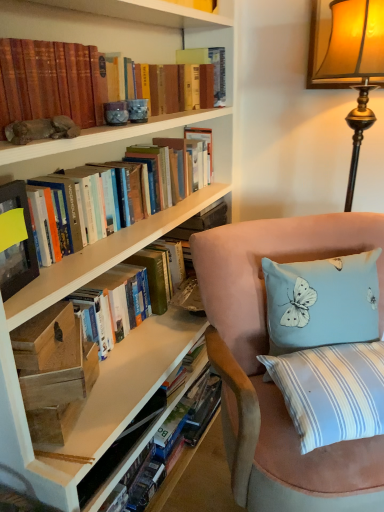
Question: Considering the positions of hardcover book at upper center, which is counted as the 4th paperback book, starting from the front, and wooden box at lower left, which is the third paperback book from right to left, in the image, is hardcover book at upper center, which is counted as the 4th paperback book, starting from the front, wider or thinner than wooden box at lower left, which is the third paperback book from right to left,?

Choices:
 (A) thin
 (B) wide

Answer: (B)

Question: Considering the relative positions of hardcover book at upper center, which is counted as the 4th paperback book, starting from the front, and wooden box at lower left, the 3th paperback book positioned from the back, in the image provided, is hardcover book at upper center, which is counted as the 4th paperback book, starting from the front, to the left or to the right of wooden box at lower left, the 3th paperback book positioned from the back,?

Choices:
 (A) left
 (B) right

Answer: (B)

Question: Estimate the real-world distances between objects in this image. Which object is closer to the hardcover book at upper center, which is counted as the 4th paperback book, starting from the front?

Choices:
 (A) light blue fabric pillow with butterfly design at right
 (B) wooden box at lower left, the 3th paperback book positioned from the back
 (C) gold textured lampshade at upper right
 (D) suede chair at lower right
 (E) hardcover books at upper left, the 1th book positioned from the top

Answer: (E)

Question: Which object is positioned farthest from the hardcover books at upper left, which is the 2th book in bottom-to-top order?

Choices:
 (A) hardcover book at upper center, placed as the first paperback book when sorted from back to front
 (B) matte black book at left, which is the 4th paperback book in back-to-front order
 (C) gold textured lampshade at upper right
 (D) suede chair at lower right
 (E) light blue fabric pillow with butterfly design at right

Answer: (C)